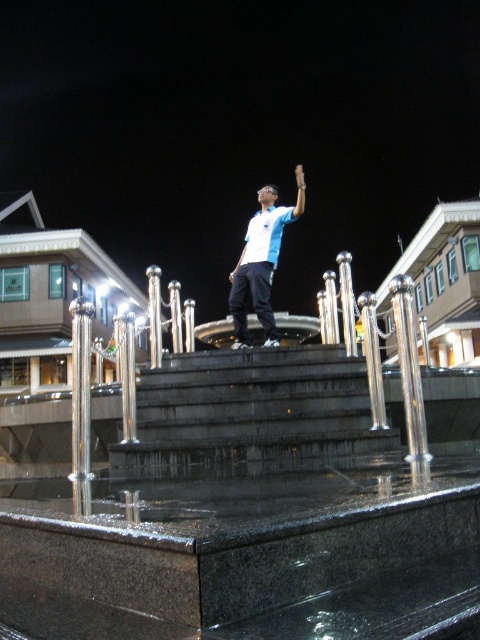
Question: Which point is closer to the camera?

Choices:
 (A) (273, 220)
 (B) (180, 355)

Answer: (B)

Question: Does black granite stairs at center have a greater width compared to matte blue shirt at center?

Choices:
 (A) yes
 (B) no

Answer: (B)

Question: Is black granite stairs at center thinner than matte blue shirt at center?

Choices:
 (A) yes
 (B) no

Answer: (A)

Question: Which object is farther from the camera taking this photo?

Choices:
 (A) black granite stairs at center
 (B) matte blue shirt at center

Answer: (B)

Question: Can you confirm if black granite stairs at center is positioned above matte blue shirt at center?

Choices:
 (A) no
 (B) yes

Answer: (A)

Question: Which object appears closest to the camera in this image?

Choices:
 (A) black granite stairs at center
 (B) matte blue shirt at center

Answer: (A)